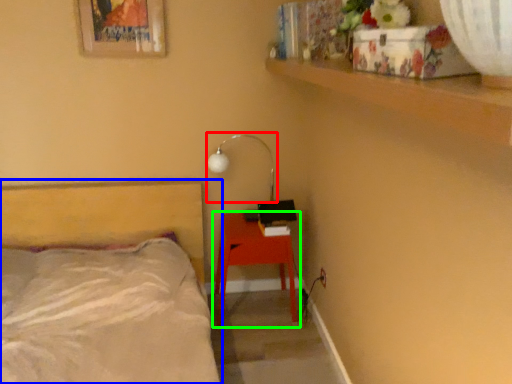
Question: Which object is positioned closest to lamp (highlighted by a red box)? Select from bed (highlighted by a blue box) and nightstand (highlighted by a green box).

Choices:
 (A) bed
 (B) nightstand

Answer: (B)